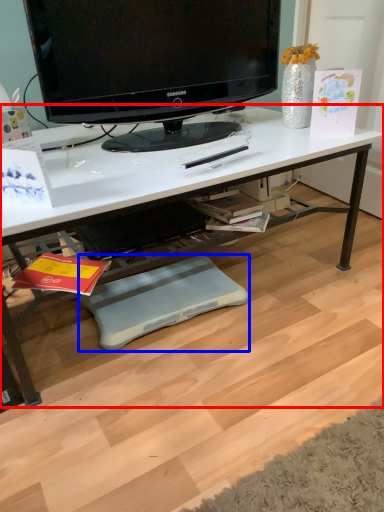
Question: Which of the following is the farthest to the observer, desk (highlighted by a red box) or footrest (highlighted by a blue box)?

Choices:
 (A) desk
 (B) footrest

Answer: (B)